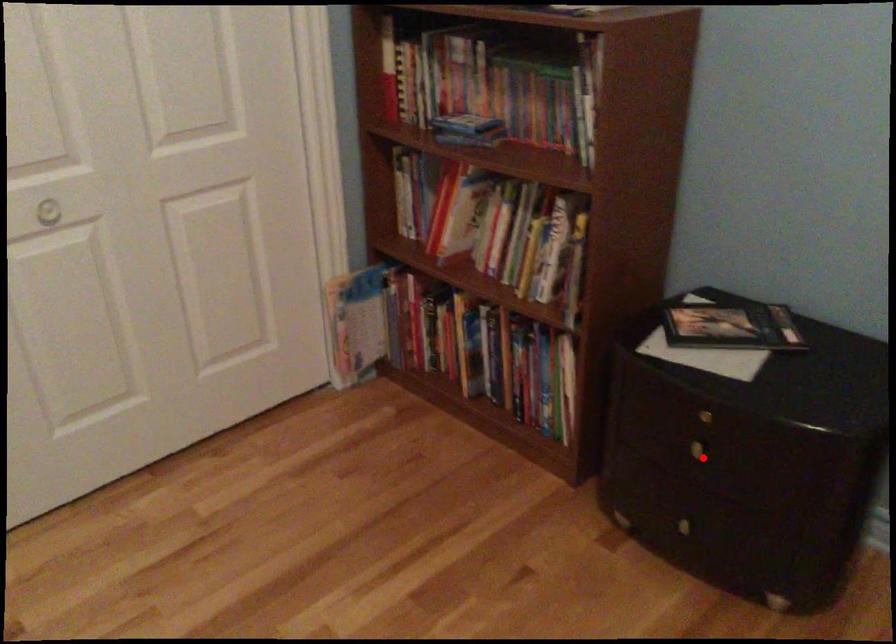
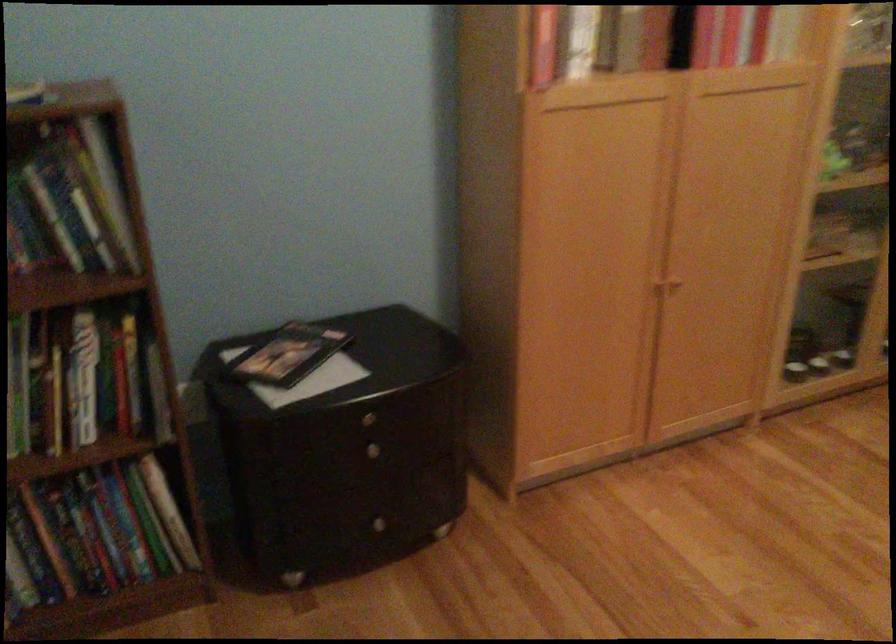
Where in the second image is the point corresponding to the highlighted location from the first image?

(376, 457)